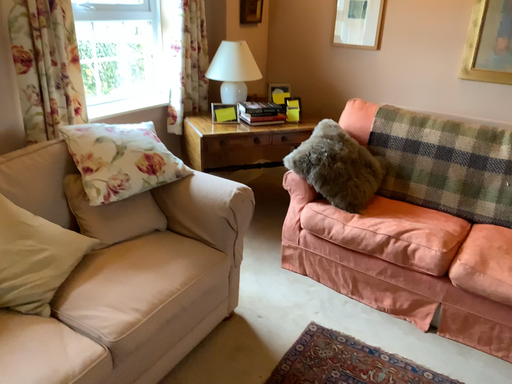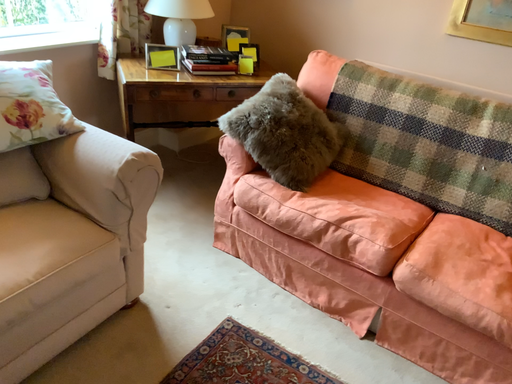
Question: How did the camera likely rotate when shooting the video?

Choices:
 (A) rotated upward
 (B) rotated downward

Answer: (B)